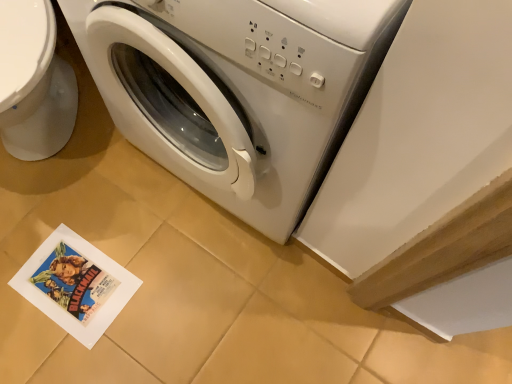
In order to face white glossy washing machine at center, should I rotate leftwards or rightwards?

You should look left and rotate roughly 0.987 degrees.

At what (x,y) coordinates should I click in order to perform the action: click on white glossy washing machine at center. Please return your answer as a coordinate pair (x, y). The image size is (512, 384). Looking at the image, I should click on (238, 89).

This screenshot has height=384, width=512. Describe the element at coordinates (238, 89) in the screenshot. I see `white glossy washing machine at center` at that location.

At what (x,y) coordinates should I click in order to perform the action: click on white glossy toilet bowl at left. Please return your answer as a coordinate pair (x, y). The height and width of the screenshot is (384, 512). Looking at the image, I should click on (34, 82).

The width and height of the screenshot is (512, 384). Describe the element at coordinates (34, 82) in the screenshot. I see `white glossy toilet bowl at left` at that location.

You are a GUI agent. You are given a task and a screenshot of the screen. Output one action in this format:
    pyautogui.click(x=<x>, y=<y>)
    Task: Click on the white glossy washing machine at center
    Image resolution: width=512 pixels, height=384 pixels.
    Given the screenshot: What is the action you would take?
    pyautogui.click(x=238, y=89)

Between white glossy washing machine at center and white glossy toilet bowl at left, which one appears on the right side from the viewer's perspective?

white glossy washing machine at center.

Is white glossy washing machine at center in front of or behind white glossy toilet bowl at left in the image?

white glossy washing machine at center is in front of white glossy toilet bowl at left.

Which is in front, point (252, 209) or point (21, 56)?

The point (21, 56) is more forward.

From the image's perspective, which one is positioned lower, white glossy washing machine at center or white glossy toilet bowl at left?

From the image's view, white glossy washing machine at center is below.

From a real-world perspective, which is physically above, white glossy washing machine at center or white glossy toilet bowl at left?

white glossy washing machine at center, from a real-world perspective.

Can you confirm if white glossy washing machine at center is thinner than white glossy toilet bowl at left?

Correct, the width of white glossy washing machine at center is less than that of white glossy toilet bowl at left.

Considering the sizes of objects white glossy washing machine at center and white glossy toilet bowl at left in the image provided, who is taller, white glossy washing machine at center or white glossy toilet bowl at left?

white glossy washing machine at center is taller.

Is white glossy washing machine at center bigger than white glossy toilet bowl at left?

Yes, white glossy washing machine at center is bigger than white glossy toilet bowl at left.

Is white glossy washing machine at center located outside white glossy toilet bowl at left?

Absolutely, white glossy washing machine at center is external to white glossy toilet bowl at left.

Is white glossy washing machine at center touching white glossy toilet bowl at left?

white glossy washing machine at center is not next to white glossy toilet bowl at left, and they're not touching.

Is white glossy washing machine at center facing towards white glossy toilet bowl at left?

No, white glossy washing machine at center does not turn towards white glossy toilet bowl at left.

How many degrees apart are the facing directions of white glossy washing machine at center and white glossy toilet bowl at left?

There is a 43-degree angle between the facing directions of white glossy washing machine at center and white glossy toilet bowl at left.

Where is `washing machine in front of the white glossy toilet bowl at left`? washing machine in front of the white glossy toilet bowl at left is located at coordinates pos(238,89).

Considering the relative positions of white glossy toilet bowl at left and white glossy washing machine at center in the image provided, is white glossy toilet bowl at left to the left of white glossy washing machine at center from the viewer's perspective?

Yes, white glossy toilet bowl at left is to the left of white glossy washing machine at center.

In the image, is white glossy toilet bowl at left positioned in front of or behind white glossy washing machine at center?

white glossy toilet bowl at left is behind white glossy washing machine at center.

Which is nearer, [6,38] or [279,101]?

Point [6,38].

From the image's perspective, is white glossy toilet bowl at left over white glossy washing machine at center?

Yes.

From a real-world perspective, relative to white glossy washing machine at center, is white glossy toilet bowl at left vertically above or below?

white glossy toilet bowl at left is below white glossy washing machine at center.

Between white glossy toilet bowl at left and white glossy washing machine at center, which one has larger width?

Wider between the two is white glossy toilet bowl at left.

Who is shorter, white glossy toilet bowl at left or white glossy washing machine at center?

With less height is white glossy toilet bowl at left.

Is white glossy toilet bowl at left bigger or smaller than white glossy washing machine at center?

In the image, white glossy toilet bowl at left appears to be smaller than white glossy washing machine at center.

Which is correct: white glossy toilet bowl at left is inside white glossy washing machine at center, or outside of it?

white glossy toilet bowl at left is not enclosed by white glossy washing machine at center.

Is white glossy toilet bowl at left positioned far away from white glossy washing machine at center?

white glossy toilet bowl at left is near white glossy washing machine at center, not far away.

Is white glossy toilet bowl at left facing away from white glossy washing machine at center?

white glossy toilet bowl at left is not turned away from white glossy washing machine at center.

How distant is white glossy toilet bowl at left from white glossy washing machine at center?

white glossy toilet bowl at left is 16.14 inches from white glossy washing machine at center.

What are the coordinates of `toilet bowl that appears above the white glossy washing machine at center (from the image's perspective)` in the screenshot? It's located at (34, 82).

Identify the location of toilet bowl behind the white glossy washing machine at center. The height and width of the screenshot is (384, 512). (34, 82).

Where is `washing machine lying in front of the white glossy toilet bowl at left`? The image size is (512, 384). washing machine lying in front of the white glossy toilet bowl at left is located at coordinates (238, 89).